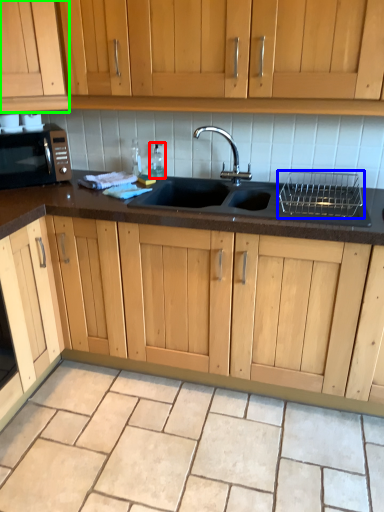
Question: Considering the real-world distances, which object is closest to bottle (highlighted by a red box)? appliance (highlighted by a blue box) or cabinetry (highlighted by a green box).

Choices:
 (A) appliance
 (B) cabinetry

Answer: (B)